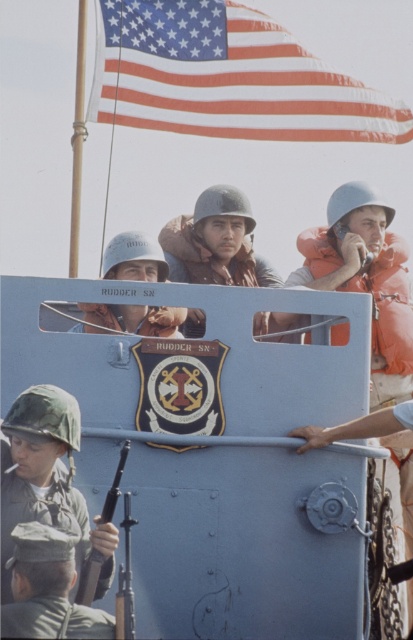
Who is more distant from viewer, (49, 428) or (37, 593)?

Positioned behind is point (49, 428).

Does point (9, 573) lie behind point (57, 598)?

Yes, it is behind point (57, 598).

Locate an element on the screen. camouflage fabric helmet at lower left is located at coordinates (47, 477).

Does american flag at upper left lie in front of camouflage fabric helmet at lower left?

No, it is behind camouflage fabric helmet at lower left.

Is american flag at upper left above camouflage fabric helmet at lower left?

Yes, american flag at upper left is above camouflage fabric helmet at lower left.

Between point (386, 132) and point (54, 504), which one is positioned behind?

The point (386, 132) is more distant.

You are a GUI agent. You are given a task and a screenshot of the screen. Output one action in this format:
    pyautogui.click(x=<x>, y=<y>)
    Task: Click on the american flag at upper left
    
    Given the screenshot: What is the action you would take?
    pyautogui.click(x=227, y=77)

Which is more to the right, matte white helmet at center or matte black rifle at lower left?

matte black rifle at lower left

Is matte white helmet at center wider than matte black rifle at lower left?

Indeed, matte white helmet at center has a greater width compared to matte black rifle at lower left.

Locate an element on the screen. This screenshot has height=640, width=413. matte white helmet at center is located at coordinates (133, 259).